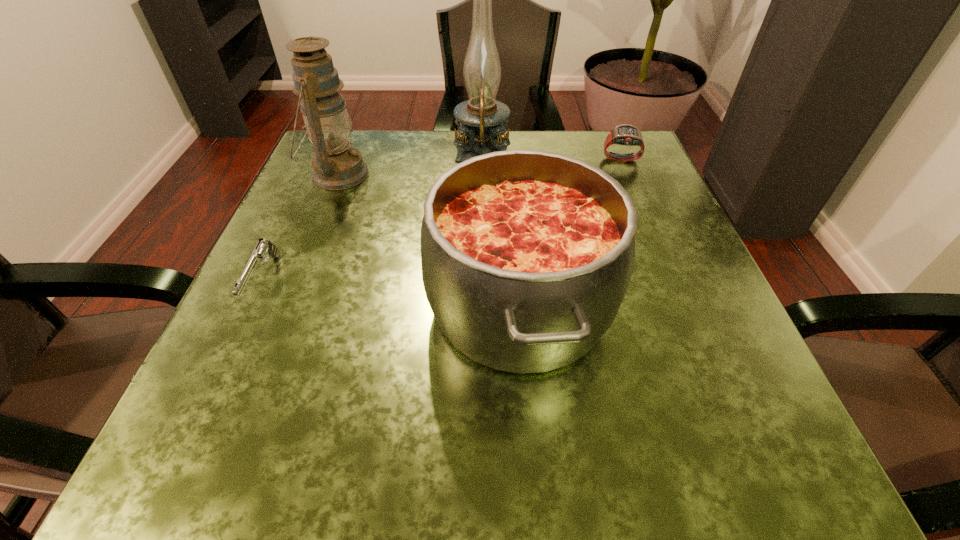
The width and height of the screenshot is (960, 540). Find the location of `the tallest object`. the tallest object is located at coordinates (481, 119).

Where is `the right oil lamp`? The width and height of the screenshot is (960, 540). the right oil lamp is located at coordinates (481, 119).

In order to click on the left oil lamp in this screenshot , I will do pyautogui.click(x=336, y=166).

Locate an element on the screen. Image resolution: width=960 pixels, height=540 pixels. the fourth shortest object is located at coordinates (336, 166).

In order to click on the third tallest object in this screenshot , I will do `click(526, 255)`.

Where is `watch`? watch is located at coordinates (625, 134).

Image resolution: width=960 pixels, height=540 pixels. I want to click on the shortest object, so click(x=263, y=249).

Where is `vacant space located on the front of the taller oil lamp`? The width and height of the screenshot is (960, 540). vacant space located on the front of the taller oil lamp is located at coordinates (482, 221).

The height and width of the screenshot is (540, 960). Identify the location of free space located on the back of the shorter oil lamp. (354, 134).

The height and width of the screenshot is (540, 960). What are the coordinates of `free spot located 0.300m on the left of the casserole` in the screenshot? It's located at (238, 306).